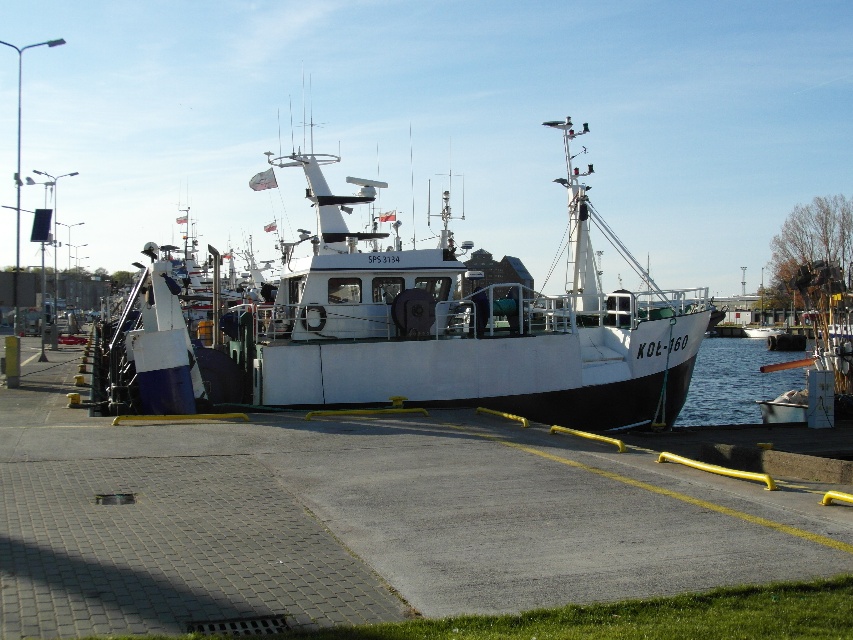
You are a photographer planning to capture the harbor scene. You want to ensure that both the white matte boat at center and the clear blue water at lower right are visible in your shot. Considering their sizes, which object should you focus on to frame the composition effectively?

The white matte boat at center is larger in size compared to the clear blue water at lower right. To frame the composition effectively, focus on the white matte boat at center as the primary subject while ensuring the clear blue water at lower right is also visible in the background or edges of the frame.

You are a marine biologist planning to board the white matte boat at center for a research trip. The boat is located at coordinates 0.511, 0.529. If the harbor map uses a coordinate system where the origin is at the bottom left corner, what direction should you head from the pier entrance located at the origin to reach the boat?

Since the boat is at coordinates (450, 326) with the origin at the bottom left corner, you should head northeast to reach the white matte boat at center from the pier entrance at the origin.

Based on the photo, you are a dock worker who needs to secure a new safety net between the white matte boat at center and the clear blue water at lower right. Based on their positions, which object should the safety net be anchored closer to?

The white matte boat at center is positioned on the left side of clear blue water at lower right, so the safety net should be anchored closer to the white matte boat at center to effectively secure the area between them.